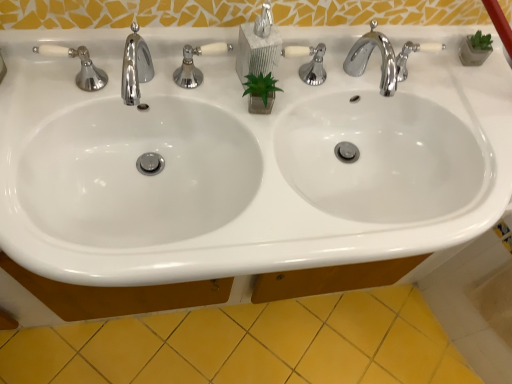
Where is `vacant space in front of matte gray soap dispenser at center`? This screenshot has height=384, width=512. vacant space in front of matte gray soap dispenser at center is located at coordinates (243, 128).